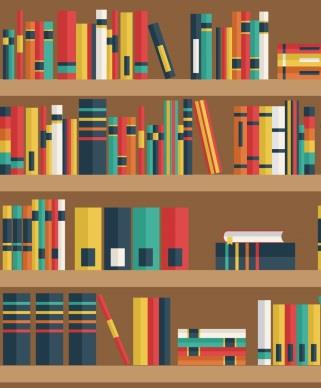
The width and height of the screenshot is (321, 388). Identify the location of books lying on their sides. (211, 360), (210, 350), (210, 342), (213, 331), (256, 256), (251, 235), (299, 47), (300, 59), (300, 71).